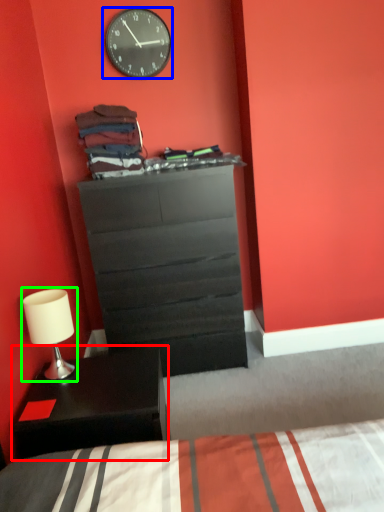
Question: Which is nearer to the nightstand (highlighted by a red box)? wall clock (highlighted by a blue box) or table lamp (highlighted by a green box).

Choices:
 (A) wall clock
 (B) table lamp

Answer: (B)